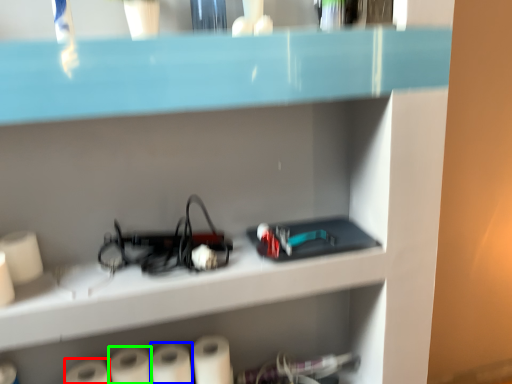
Question: Which object is the farthest from paper towel (highlighted by a red box)? Choose among these: paper towel (highlighted by a blue box) or paper towel (highlighted by a green box).

Choices:
 (A) paper towel
 (B) paper towel

Answer: (A)